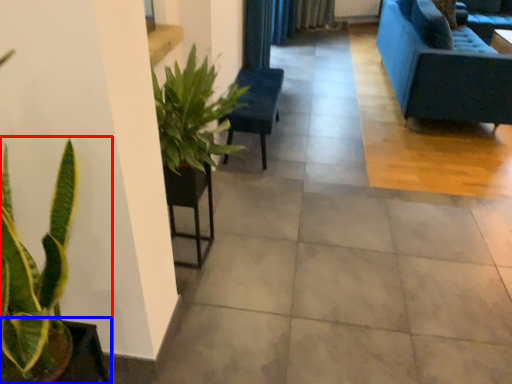
Question: Among these objects, which one is farthest to the camera, houseplant (highlighted by a red box) or flowerpot (highlighted by a blue box)?

Choices:
 (A) houseplant
 (B) flowerpot

Answer: (B)